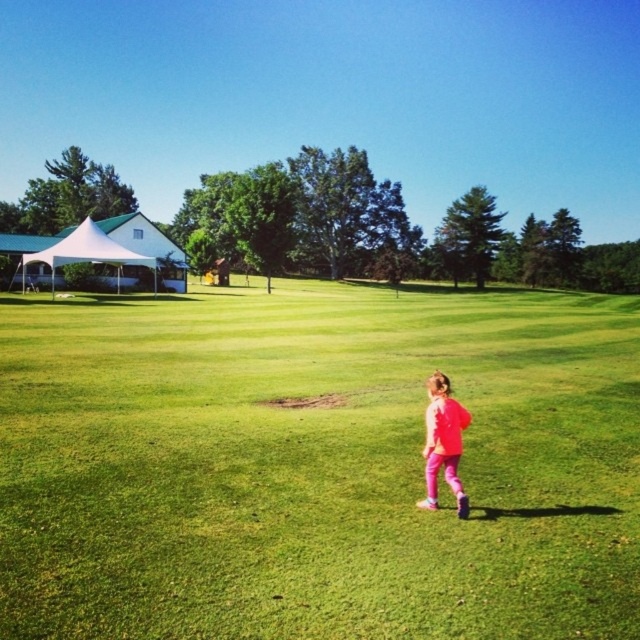
You are standing at the point marked by the coordinates point [317,465] in the image. What is the name of the object you are standing on?

The point [317,465] indicates green grass at center, so you are standing on the green grass at center.

You are a photographer standing at the edge of the field. You want to take a photo that includes both the white fabric tent at left and the pink matte pants at center without any obstructions. Based on their positions, can you see both objects clearly in your current view?

The white fabric tent at left is positioned over pink matte pants at center, so the tent is blocking the view of the pink matte pants at center. Therefore, you cannot see both objects clearly in your current view.

You are a photographer trying to capture the entire white fabric tent at left and the pink matte pants at center in a single photo. Given that your camera can only focus on objects within a 10m range, can you fit both objects in the frame without moving closer or farther away?

The white fabric tent at left is bigger than the pink matte pants at center, so the photographer can fit both objects in the frame as long as they are within the camera range.